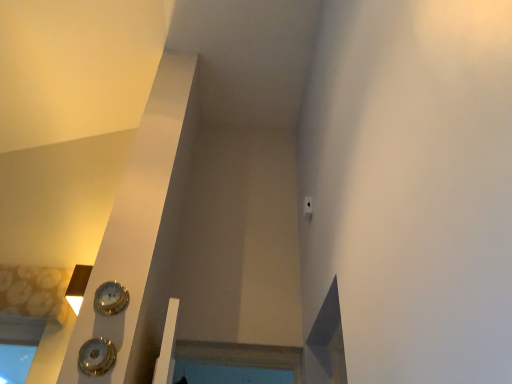
Describe the element at coordinates (111, 298) in the screenshot. The height and width of the screenshot is (384, 512). I see `gold metallic clock at lower left, which is the 1th clock from top to bottom` at that location.

Measure the distance between gold metallic clock at lower left, the second clock when ordered from front to back, and camera.

5.81 feet.

I want to click on gold metallic clock at lower left, which is the 1th clock from top to bottom, so (111, 298).

What is the approximate width of gold metallic clock at lower left, the second clock when ordered from front to back?

gold metallic clock at lower left, the second clock when ordered from front to back, is 2.49 inches in width.

Locate an element on the screen. Image resolution: width=512 pixels, height=384 pixels. shiny silver clock at lower left, the 2th clock from the back is located at coordinates (96, 356).

Image resolution: width=512 pixels, height=384 pixels. Describe the element at coordinates (96, 356) in the screenshot. I see `shiny silver clock at lower left, the 2th clock from the back` at that location.

The width and height of the screenshot is (512, 384). I want to click on gold metallic clock at lower left, the second clock when ordered from front to back, so click(111, 298).

Based on their positions, is shiny silver clock at lower left, placed as the second clock when sorted from top to bottom, located to the left or right of gold metallic clock at lower left, which is the 1th clock from top to bottom?

From the image, it's evident that shiny silver clock at lower left, placed as the second clock when sorted from top to bottom, is to the left of gold metallic clock at lower left, which is the 1th clock from top to bottom.

Who is more distant, shiny silver clock at lower left, the 2th clock from the back, or gold metallic clock at lower left, the 2th clock when ordered from bottom to top?

Positioned behind is gold metallic clock at lower left, the 2th clock when ordered from bottom to top.

Which is farther from the camera, (102,374) or (105,310)?

Point (105,310)

From the image's perspective, is shiny silver clock at lower left, placed as the second clock when sorted from top to bottom, above or below gold metallic clock at lower left, the second clock when ordered from front to back?

Based on their image positions, shiny silver clock at lower left, placed as the second clock when sorted from top to bottom, is located beneath gold metallic clock at lower left, the second clock when ordered from front to back.

From a real-world perspective, is shiny silver clock at lower left, which is the first clock in front-to-back order, physically below gold metallic clock at lower left, which is the 1th clock from top to bottom?

Indeed, from a real-world perspective, shiny silver clock at lower left, which is the first clock in front-to-back order, is positioned beneath gold metallic clock at lower left, which is the 1th clock from top to bottom.

Which object is wider, shiny silver clock at lower left, which is the first clock in front-to-back order, or gold metallic clock at lower left, the second clock when ordered from front to back?

With larger width is shiny silver clock at lower left, which is the first clock in front-to-back order.

Can you confirm if shiny silver clock at lower left, which is the first clock in front-to-back order, is shorter than gold metallic clock at lower left, the 2th clock when ordered from bottom to top?

In fact, shiny silver clock at lower left, which is the first clock in front-to-back order, may be taller than gold metallic clock at lower left, the 2th clock when ordered from bottom to top.

Based on their sizes in the image, would you say shiny silver clock at lower left, the 2th clock from the back, is bigger or smaller than gold metallic clock at lower left, acting as the 1th clock starting from the back?

Considering their sizes, shiny silver clock at lower left, the 2th clock from the back, takes up more space than gold metallic clock at lower left, acting as the 1th clock starting from the back.

Is shiny silver clock at lower left, the 2th clock from the back, surrounding gold metallic clock at lower left, the second clock when ordered from front to back?

Actually, gold metallic clock at lower left, the second clock when ordered from front to back, is outside shiny silver clock at lower left, the 2th clock from the back.

Is shiny silver clock at lower left, which is the first clock from bottom to top, in contact with gold metallic clock at lower left, which is the 1th clock from top to bottom?

No, shiny silver clock at lower left, which is the first clock from bottom to top, is not making contact with gold metallic clock at lower left, which is the 1th clock from top to bottom.

Is shiny silver clock at lower left, which is the first clock from bottom to top, positioned with its back to gold metallic clock at lower left, acting as the 1th clock starting from the back?

That's not correct — shiny silver clock at lower left, which is the first clock from bottom to top, is not looking away from gold metallic clock at lower left, acting as the 1th clock starting from the back.

How far apart are shiny silver clock at lower left, which is the first clock from bottom to top, and gold metallic clock at lower left, the 2th clock when ordered from bottom to top?

6.66 inches.

The image size is (512, 384). What are the coordinates of `clock below the gold metallic clock at lower left, acting as the 1th clock starting from the back (from the image's perspective)` in the screenshot? It's located at (96, 356).

Based on their positions, is gold metallic clock at lower left, acting as the 1th clock starting from the back, located to the left or right of shiny silver clock at lower left, which is the first clock in front-to-back order?

From the image, it's evident that gold metallic clock at lower left, acting as the 1th clock starting from the back, is to the right of shiny silver clock at lower left, which is the first clock in front-to-back order.

Based on the photo, is the position of gold metallic clock at lower left, the 2th clock when ordered from bottom to top, more distant than that of shiny silver clock at lower left, the 2th clock from the back?

Yes, it is.

Is point (101, 305) less distant than point (104, 363)?

No, (101, 305) is further to viewer.

From the image's perspective, which is above, gold metallic clock at lower left, the 2th clock when ordered from bottom to top, or shiny silver clock at lower left, placed as the second clock when sorted from top to bottom?

gold metallic clock at lower left, the 2th clock when ordered from bottom to top, appears higher in the image.

From a real-world perspective, is gold metallic clock at lower left, acting as the 1th clock starting from the back, physically located above or below shiny silver clock at lower left, placed as the second clock when sorted from top to bottom?

From a real-world perspective, gold metallic clock at lower left, acting as the 1th clock starting from the back, is physically above shiny silver clock at lower left, placed as the second clock when sorted from top to bottom.

Does gold metallic clock at lower left, which is the 1th clock from top to bottom, have a greater width compared to shiny silver clock at lower left, which is the first clock from bottom to top?

Incorrect, the width of gold metallic clock at lower left, which is the 1th clock from top to bottom, does not surpass that of shiny silver clock at lower left, which is the first clock from bottom to top.

From their relative heights in the image, would you say gold metallic clock at lower left, acting as the 1th clock starting from the back, is taller or shorter than shiny silver clock at lower left, the 2th clock from the back?

gold metallic clock at lower left, acting as the 1th clock starting from the back, is shorter than shiny silver clock at lower left, the 2th clock from the back.

Who is bigger, gold metallic clock at lower left, the 2th clock when ordered from bottom to top, or shiny silver clock at lower left, the 2th clock from the back?

Bigger between the two is shiny silver clock at lower left, the 2th clock from the back.

Is gold metallic clock at lower left, the 2th clock when ordered from bottom to top, situated inside shiny silver clock at lower left, placed as the second clock when sorted from top to bottom, or outside?

gold metallic clock at lower left, the 2th clock when ordered from bottom to top, is not inside shiny silver clock at lower left, placed as the second clock when sorted from top to bottom, it's outside.

Is gold metallic clock at lower left, acting as the 1th clock starting from the back, placed right next to shiny silver clock at lower left, the 2th clock from the back?

No, gold metallic clock at lower left, acting as the 1th clock starting from the back, is not with shiny silver clock at lower left, the 2th clock from the back.

Is gold metallic clock at lower left, acting as the 1th clock starting from the back, oriented towards shiny silver clock at lower left, which is the first clock from bottom to top?

No, gold metallic clock at lower left, acting as the 1th clock starting from the back, does not turn towards shiny silver clock at lower left, which is the first clock from bottom to top.

Can you tell me how much gold metallic clock at lower left, which is the 1th clock from top to bottom, and shiny silver clock at lower left, which is the first clock from bottom to top, differ in facing direction?

The angle between the facing direction of gold metallic clock at lower left, which is the 1th clock from top to bottom, and the facing direction of shiny silver clock at lower left, which is the first clock from bottom to top, is 0.473 degrees.

The height and width of the screenshot is (384, 512). I want to click on clock on the right of shiny silver clock at lower left, the 2th clock from the back, so click(x=111, y=298).

Where is `clock below the gold metallic clock at lower left, which is the 1th clock from top to bottom (from a real-world perspective)`? clock below the gold metallic clock at lower left, which is the 1th clock from top to bottom (from a real-world perspective) is located at coordinates (96, 356).

At what (x,y) coordinates should I click in order to perform the action: click on clock above the shiny silver clock at lower left, the 2th clock from the back (from the image's perspective). Please return your answer as a coordinate pair (x, y). Looking at the image, I should click on (111, 298).